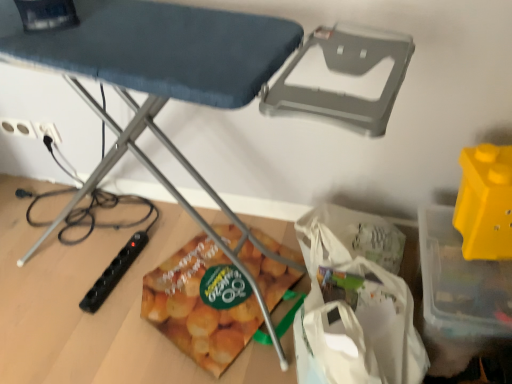
You are a GUI agent. You are given a task and a screenshot of the screen. Output one action in this format:
    pyautogui.click(x=<x>, y=<y>)
    Task: Click on the vacant area situated below metallic ironing board at center (from a real-world perspective)
    This screenshot has height=384, width=512.
    Given the screenshot: What is the action you would take?
    pyautogui.click(x=86, y=255)